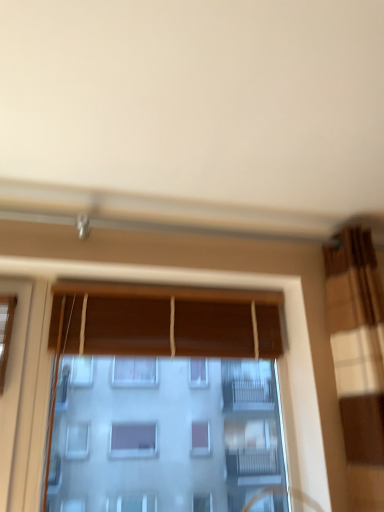
Measure the distance between point (369,440) and camera.

1.38 meters.

What is the approximate width of brown textured curtain at right, arranged as the 2th curtain when viewed from the left?

It is 8.26 inches.

I want to click on brown textured curtain at right, arranged as the 2th curtain when viewed from the left, so click(357, 342).

From the image's perspective, is brown textured curtain at right, the 1th curtain viewed from the right, located above wooden blinds at center?

Yes, from the image's perspective, brown textured curtain at right, the 1th curtain viewed from the right, is on top of wooden blinds at center.

Can you confirm if brown textured curtain at right, the 1th curtain viewed from the right, is thinner than wooden blinds at center?

In fact, brown textured curtain at right, the 1th curtain viewed from the right, might be wider than wooden blinds at center.

Is brown textured curtain at right, the 1th curtain viewed from the right, in front of or behind wooden blinds at center in the image?

brown textured curtain at right, the 1th curtain viewed from the right, is positioned closer to the viewer than wooden blinds at center.

Could you tell me if brown textured curtain at right, the 1th curtain viewed from the right, is turned towards wooden blinds at center?

No, brown textured curtain at right, the 1th curtain viewed from the right, does not turn towards wooden blinds at center.

Looking at this image, from a real-world perspective, between wooden blinds at center and brown textured curtain at right, arranged as the 2th curtain when viewed from the left, who is vertically lower?

wooden blinds at center, from a real-world perspective.

From the image's perspective, is wooden blinds at center located above brown textured curtain at right, the 1th curtain viewed from the right?

No, from the image's perspective, wooden blinds at center is not above brown textured curtain at right, the 1th curtain viewed from the right.

Which of these two, wooden blinds at center or brown textured curtain at right, the 1th curtain viewed from the right, stands taller?

With more height is brown textured curtain at right, the 1th curtain viewed from the right.

Is brown textured curtain at right, arranged as the 2th curtain when viewed from the left, at the back of wooden blinds at center?

No, wooden blinds at center is not facing away from brown textured curtain at right, arranged as the 2th curtain when viewed from the left.

Which object is thinner, wooden blinds at center, placed as the first curtain when sorted from left to right, or brown textured curtain at right, the 1th curtain viewed from the right?

Thinner between the two is wooden blinds at center, placed as the first curtain when sorted from left to right.

From the image's perspective, would you say wooden blinds at center, placed as the first curtain when sorted from left to right, is positioned over brown textured curtain at right, arranged as the 2th curtain when viewed from the left?

Yes, from the image's perspective, wooden blinds at center, placed as the first curtain when sorted from left to right, is above brown textured curtain at right, arranged as the 2th curtain when viewed from the left.

Are wooden blinds at center, placed as the first curtain when sorted from left to right, and brown textured curtain at right, the 1th curtain viewed from the right, making contact?

They are not placed beside each other.

Would you say brown textured curtain at right, arranged as the 2th curtain when viewed from the left, is inside or outside wooden blinds at center, the second curtain positioned from the right?

brown textured curtain at right, arranged as the 2th curtain when viewed from the left, lies outside wooden blinds at center, the second curtain positioned from the right.

Can you confirm if brown textured curtain at right, arranged as the 2th curtain when viewed from the left, is bigger than wooden blinds at center, the second curtain positioned from the right?

Yes.

From a real-world perspective, is brown textured curtain at right, the 1th curtain viewed from the right, on wooden blinds at center, the second curtain positioned from the right?

No.

Based on the photo, considering the relative sizes of wooden blinds at center, the second curtain positioned from the right, and wooden blinds at center in the image provided, is wooden blinds at center, the second curtain positioned from the right, shorter than wooden blinds at center?

Yes.

Considering the sizes of objects wooden blinds at center, the second curtain positioned from the right, and wooden blinds at center in the image provided, who is wider, wooden blinds at center, the second curtain positioned from the right, or wooden blinds at center?

With larger width is wooden blinds at center.

Which object is further away from the camera, wooden blinds at center, the second curtain positioned from the right, or wooden blinds at center?

wooden blinds at center, the second curtain positioned from the right, is more distant.

Is wooden blinds at center, the second curtain positioned from the right, surrounded by wooden blinds at center?

No, wooden blinds at center, the second curtain positioned from the right, is located outside of wooden blinds at center.

Which is closer to the camera, (146, 401) or (260, 315)?

Positioned in front is point (146, 401).

Between wooden blinds at center and wooden blinds at center, the second curtain positioned from the right, which one has smaller size?

wooden blinds at center, the second curtain positioned from the right, is smaller.

From the picture: Between wooden blinds at center and wooden blinds at center, placed as the first curtain when sorted from left to right, which one appears on the left side from the viewer's perspective?

Positioned to the left is wooden blinds at center.

Locate an element on the screen. The height and width of the screenshot is (512, 384). window below the brown textured curtain at right, arranged as the 2th curtain when viewed from the left (from the image's perspective) is located at coordinates (164, 399).

From a real-world perspective, starting from the wooden blinds at center, which curtain is the 1st one vertically above it? Please provide its 2D coordinates.

[(357, 342)]

When comparing their distances from wooden blinds at center, does brown textured curtain at right, arranged as the 2th curtain when viewed from the left, or wooden blinds at center, the second curtain positioned from the right, seem closer?

wooden blinds at center, the second curtain positioned from the right, lies closer to wooden blinds at center than the other object.

Which object lies further to the anchor point brown textured curtain at right, the 1th curtain viewed from the right, wooden blinds at center, placed as the first curtain when sorted from left to right, or wooden blinds at center?

wooden blinds at center, placed as the first curtain when sorted from left to right, is further to brown textured curtain at right, the 1th curtain viewed from the right.

Based on their spatial positions, is wooden blinds at center or wooden blinds at center, placed as the first curtain when sorted from left to right, closer to brown textured curtain at right, arranged as the 2th curtain when viewed from the left?

wooden blinds at center.

Looking at the image, which one is located closer to wooden blinds at center, wooden blinds at center, placed as the first curtain when sorted from left to right, or brown textured curtain at right, arranged as the 2th curtain when viewed from the left?

wooden blinds at center, placed as the first curtain when sorted from left to right.

From the image, which object appears to be nearer to wooden blinds at center, the second curtain positioned from the right, wooden blinds at center or brown textured curtain at right, arranged as the 2th curtain when viewed from the left?

wooden blinds at center lies closer to wooden blinds at center, the second curtain positioned from the right, than the other object.

When comparing their distances from wooden blinds at center, the second curtain positioned from the right, does brown textured curtain at right, the 1th curtain viewed from the right, or wooden blinds at center seem further?

brown textured curtain at right, the 1th curtain viewed from the right.

Where is `curtain located between wooden blinds at center and brown textured curtain at right, the 1th curtain viewed from the right, in the left-right direction`? This screenshot has height=512, width=384. curtain located between wooden blinds at center and brown textured curtain at right, the 1th curtain viewed from the right, in the left-right direction is located at coordinates (127, 324).